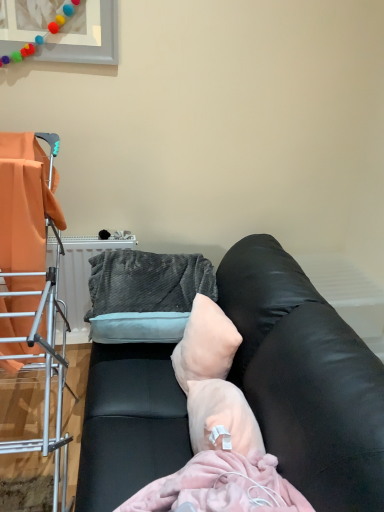
Question: Considering the positions of pale pink fabric pillow at center and metal drying rack at left in the image, is pale pink fabric pillow at center wider or thinner than metal drying rack at left?

Choices:
 (A) wide
 (B) thin

Answer: (B)

Question: From a real-world perspective, is pale pink fabric pillow at center positioned above or below metal drying rack at left?

Choices:
 (A) above
 (B) below

Answer: (B)

Question: Estimate the real-world distances between objects in this image. Which object is farther from the metal drying rack at left?

Choices:
 (A) black leather couch at center
 (B) pale pink fabric pillow at center
 (C) velvety gray bean bag chair at center

Answer: (A)

Question: Which object is the closest to the metal drying rack at left?

Choices:
 (A) pale pink fabric pillow at center
 (B) black leather couch at center
 (C) velvety gray bean bag chair at center

Answer: (C)